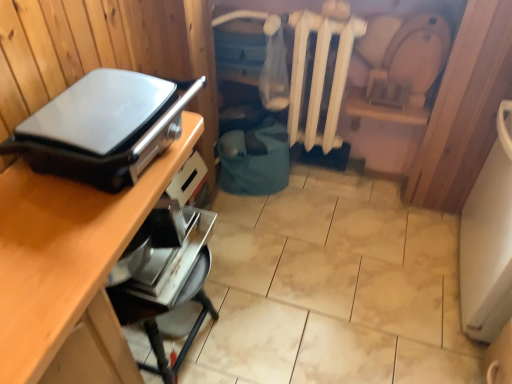
The image size is (512, 384). I want to click on vacant area on top of white matte radiator at center (from a real-world perspective), so click(332, 11).